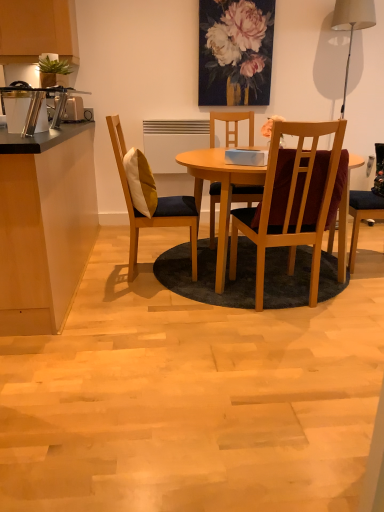
Question: Does white fabric lampshade at upper right have a greater height compared to wooden chair at center, arranged as the 1th chair when viewed from the right?

Choices:
 (A) yes
 (B) no

Answer: (A)

Question: Is white fabric lampshade at upper right shorter than wooden chair at center, which is the 2th chair in left-to-right order?

Choices:
 (A) yes
 (B) no

Answer: (B)

Question: Is white fabric lampshade at upper right to the right of wooden chair at center, which is the 2th chair in left-to-right order, from the viewer's perspective?

Choices:
 (A) yes
 (B) no

Answer: (A)

Question: Is white fabric lampshade at upper right to the left of wooden chair at center, arranged as the 1th chair when viewed from the right, from the viewer's perspective?

Choices:
 (A) no
 (B) yes

Answer: (A)

Question: Considering the relative sizes of white fabric lampshade at upper right and wooden chair at center, arranged as the 1th chair when viewed from the right, in the image provided, is white fabric lampshade at upper right thinner than wooden chair at center, arranged as the 1th chair when viewed from the right,?

Choices:
 (A) yes
 (B) no

Answer: (A)

Question: Does point (150, 182) appear closer or farther from the camera than point (74, 268)?

Choices:
 (A) farther
 (B) closer

Answer: (B)

Question: Relative to black laminate countertop at left, is matte yellow pillow at center in front or behind?

Choices:
 (A) behind
 (B) front

Answer: (A)

Question: In terms of size, does matte yellow pillow at center appear bigger or smaller than black laminate countertop at left?

Choices:
 (A) small
 (B) big

Answer: (A)

Question: From the image's perspective, relative to black laminate countertop at left, is matte yellow pillow at center above or below?

Choices:
 (A) below
 (B) above

Answer: (B)

Question: Is point [14, 305] closer or farther from the camera than point [77, 118]?

Choices:
 (A) closer
 (B) farther

Answer: (A)

Question: Looking at their shapes, would you say black laminate countertop at left is wider or thinner than silver metallic toaster at left?

Choices:
 (A) wide
 (B) thin

Answer: (A)

Question: From the image's perspective, is black laminate countertop at left positioned above or below silver metallic toaster at left?

Choices:
 (A) above
 (B) below

Answer: (B)

Question: Is black laminate countertop at left inside or outside of silver metallic toaster at left?

Choices:
 (A) outside
 (B) inside

Answer: (A)

Question: From their relative heights in the image, would you say white fabric lampshade at upper right is taller or shorter than matte floral painting at upper center?

Choices:
 (A) tall
 (B) short

Answer: (A)

Question: From the image's perspective, is white fabric lampshade at upper right located above or below matte floral painting at upper center?

Choices:
 (A) above
 (B) below

Answer: (B)